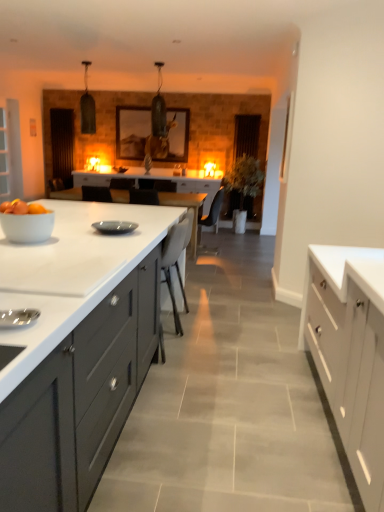
Question: Relative to white wood cabinet at right, which is the second cabinetry in left-to-right order, is white fabric chair at center in front or behind?

Choices:
 (A) front
 (B) behind

Answer: (B)

Question: From the image's perspective, is white fabric chair at center located above or below white wood cabinet at right, the 1th cabinetry from the right?

Choices:
 (A) above
 (B) below

Answer: (A)

Question: Estimate the real-world distances between objects in this image. Which object is closer to the white glossy bowl at left?

Choices:
 (A) matte gray plate at center
 (B) white fabric chair at center
 (C) matte black glass door at upper left, which is counted as the first glass door, starting from the back
 (D) transparent glass door at left, which is the first glass door from left to right
 (E) white wood cabinet at right, the 1th cabinetry from the right

Answer: (A)

Question: Which is farther from the white glossy bowl at left?

Choices:
 (A) white fabric chair at center
 (B) matte gray plate at center
 (C) matte gray cabinets at center, positioned as the 1th cabinetry in left-to-right order
 (D) white wood cabinet at right, the 1th cabinetry from the right
 (E) matte black glass door at upper left, which is counted as the first glass door, starting from the back

Answer: (E)